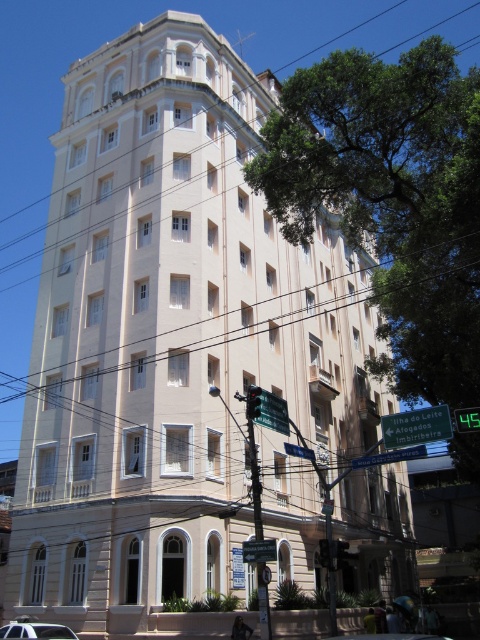
Based on the photo, you are standing on the sidewalk in front of the building and want to find the green plastic street sign at center. According to the scene description, where should you look relative to the building?

The green plastic street sign at center is located at point 0.714 on the x axis and 0.812 on the y axis relative to the building.

You are a pedestrian standing on the sidewalk in front of the building. You see the green plastic street sign at center and the metallic silver car at center. Which object is taller?

The metallic silver car at center is taller than the green plastic street sign at center.

You are standing on the sidewalk in front of the building and see the point marked at coordinates (416, 426). What object is located at that point?

The point at coordinates (416, 426) marks the location of the green plastic sign at center.